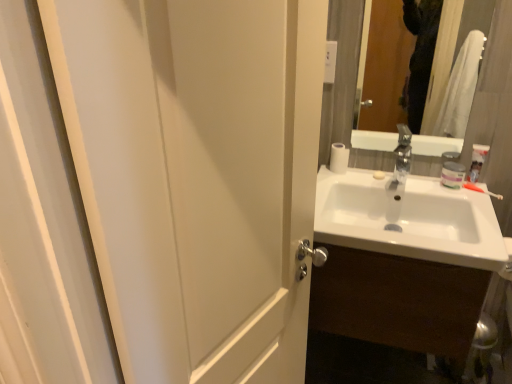
Where is `vacant area that is in front of white matte jar at upper right`? This screenshot has width=512, height=384. vacant area that is in front of white matte jar at upper right is located at coordinates (460, 193).